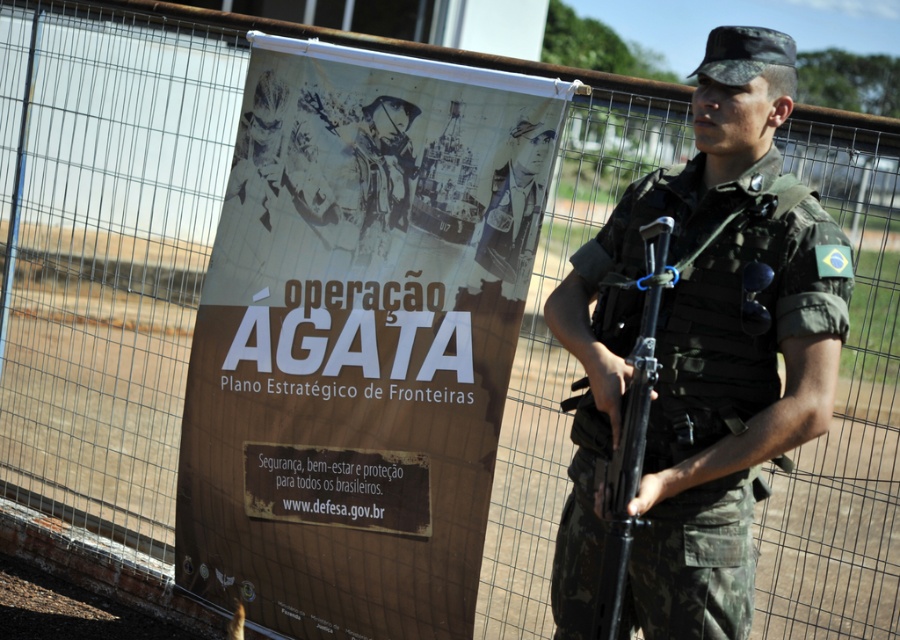
Question: Is the position of brown paper poster at center less distant than that of camouflage uniform at center?

Choices:
 (A) yes
 (B) no

Answer: (B)

Question: Which of the following is the closest to the observer?

Choices:
 (A) (424, 634)
 (B) (641, 442)

Answer: (B)

Question: Is brown paper poster at center below camouflage uniform at center?

Choices:
 (A) no
 (B) yes

Answer: (A)

Question: Among these objects, which one is nearest to the camera?

Choices:
 (A) brown paper poster at center
 (B) camouflage uniform at center

Answer: (B)

Question: Which object is positioned farthest from the camouflage uniform at center?

Choices:
 (A) brown paper poster at center
 (B) camouflage-patterned rifle at center

Answer: (A)

Question: Does camouflage uniform at center appear on the left side of camouflage-patterned rifle at center?

Choices:
 (A) no
 (B) yes

Answer: (A)